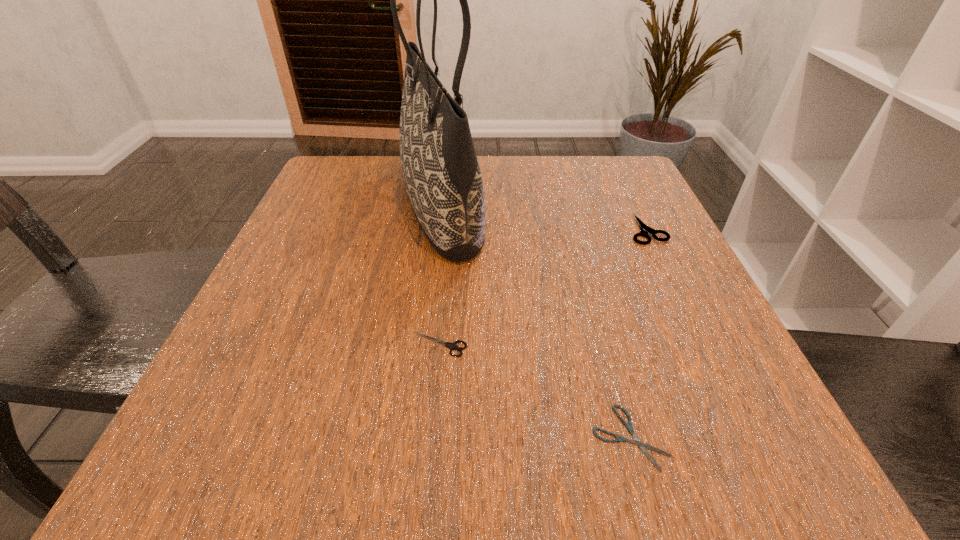
At what (x,y) coordinates should I click in order to perform the action: click on free point between the nearest shears and the tote bag. Please return your answer as a coordinate pair (x, y). The width and height of the screenshot is (960, 540). Looking at the image, I should click on (536, 322).

You are a GUI agent. You are given a task and a screenshot of the screen. Output one action in this format:
    pyautogui.click(x=<x>, y=<y>)
    Task: Click on the unoccupied position between the tallest shears and the nearest shears
    This screenshot has height=540, width=960.
    Given the screenshot: What is the action you would take?
    pyautogui.click(x=638, y=333)

Identify which object is located as the third nearest to the nearest shears. Please provide its 2D coordinates. Your answer should be formatted as a tuple, i.e. [(x, y)], where the tuple contains the x and y coordinates of a point satisfying the conditions above.

[(644, 229)]

This screenshot has width=960, height=540. Find the location of `object that stands as the closest to the second tallest shears`. object that stands as the closest to the second tallest shears is located at coordinates (441, 172).

Locate which shears is the third closest to the tote bag. Please provide its 2D coordinates. Your answer should be formatted as a tuple, i.e. [(x, y)], where the tuple contains the x and y coordinates of a point satisfying the conditions above.

[(643, 446)]

This screenshot has width=960, height=540. What are the coordinates of `shears that is the third closest to the tallest object` in the screenshot? It's located at (643, 446).

Find the location of a particular element. This screenshot has height=540, width=960. free space in the image that satisfies the following two spatial constraints: 1. on the front side of the farthest shears; 2. on the right side of the tote bag is located at coordinates (438, 230).

Locate an element on the screen. free spot that satisfies the following two spatial constraints: 1. on the front side of the third farthest object; 2. on the right side of the shortest object is located at coordinates (432, 437).

Identify the location of free location that satisfies the following two spatial constraints: 1. on the back side of the third farthest object; 2. on the left side of the rightmost shears. The width and height of the screenshot is (960, 540). (450, 230).

Locate an element on the screen. The width and height of the screenshot is (960, 540). free spot that satisfies the following two spatial constraints: 1. on the front side of the shortest shears; 2. on the left side of the second nearest shears is located at coordinates (432, 437).